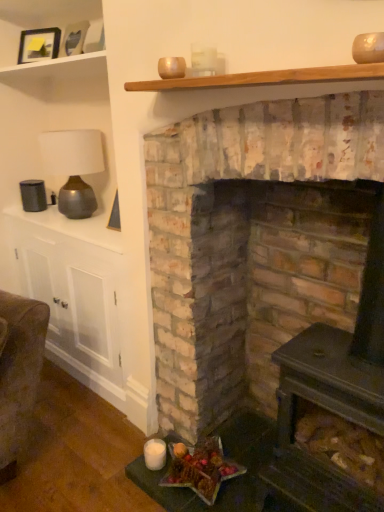
Question: Considering the positions of matte black picture frame at upper left, placed as the 2th picture frame when sorted from right to left, and wooden picture frame at upper left, the 2th picture frame from the back, in the image, is matte black picture frame at upper left, placed as the 2th picture frame when sorted from right to left, taller or shorter than wooden picture frame at upper left, the 2th picture frame from the back,?

Choices:
 (A) tall
 (B) short

Answer: (B)

Question: Considering the positions of matte black picture frame at upper left, which appears as the 1th picture frame when viewed from the left, and wooden picture frame at upper left, acting as the first picture frame starting from the front, in the image, is matte black picture frame at upper left, which appears as the 1th picture frame when viewed from the left, bigger or smaller than wooden picture frame at upper left, acting as the first picture frame starting from the front,?

Choices:
 (A) big
 (B) small

Answer: (B)

Question: Considering the real-world distances, which object is farthest from the matte brown lamp at upper left?

Choices:
 (A) wooden shelf at upper left, arranged as the 2th shelf when ordered from the bottom
 (B) brick fireplace at center
 (C) matte black picture frame at upper left, placed as the 2th picture frame when sorted from right to left
 (D) wooden picture frame at upper left, the 1th picture frame viewed from the right
 (E) wooden plank at upper center, positioned as the 1th shelf in bottom-to-top order

Answer: (E)

Question: Based on their relative distances, which object is farther from the wooden picture frame at upper left, acting as the first picture frame starting from the front?

Choices:
 (A) wooden shelf at upper left, the first shelf when ordered from back to front
 (B) matte black picture frame at upper left, placed as the 2th picture frame when sorted from right to left
 (C) matte brown lamp at upper left
 (D) shiny metallic star at lower center
 (E) wooden plank at upper center, the second shelf when ordered from back to front

Answer: (D)